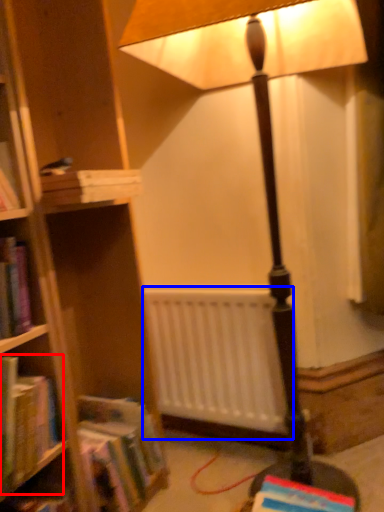
Question: Which object appears closest to the camera in this image, book (highlighted by a red box) or radiator (highlighted by a blue box)?

Choices:
 (A) book
 (B) radiator

Answer: (A)